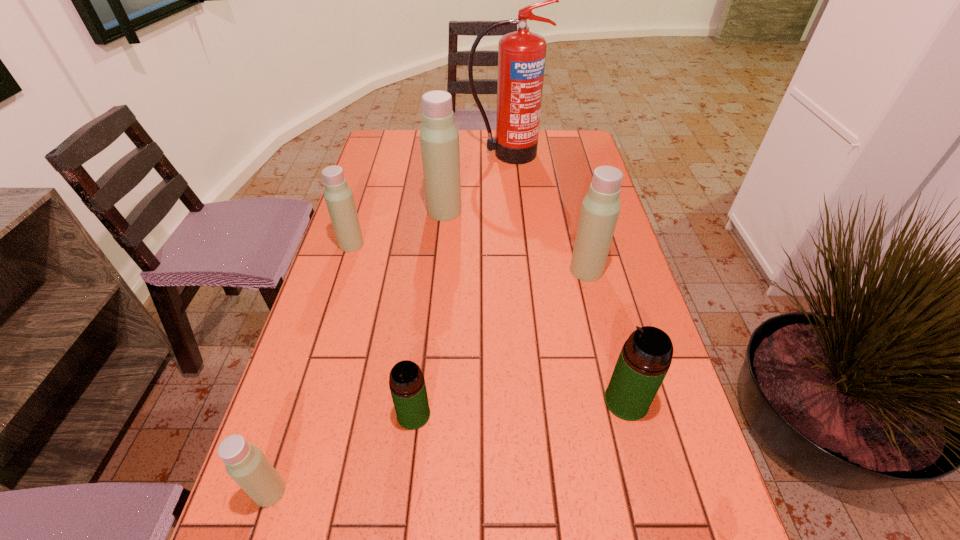
This screenshot has height=540, width=960. What are the coordinates of `the nearest thermos bottle` in the screenshot? It's located at (245, 463).

Locate an element on the screen. the smallest light thermos bottle is located at coordinates (245, 463).

Where is `vacant area located 0.240m on the surface of the fifth object from left to right`? This screenshot has height=540, width=960. vacant area located 0.240m on the surface of the fifth object from left to right is located at coordinates (511, 205).

At what (x,y) coordinates should I click in order to perform the action: click on vacant space located on the left of the farthest thermos bottle. Please return your answer as a coordinate pair (x, y). This screenshot has height=540, width=960. Looking at the image, I should click on (389, 211).

Where is `vacant position located on the left of the third tallest object`? This screenshot has width=960, height=540. vacant position located on the left of the third tallest object is located at coordinates (540, 270).

Locate an element on the screen. This screenshot has height=540, width=960. free space located 0.060m on the back of the fifth nearest thermos bottle is located at coordinates (358, 223).

Locate an element on the screen. vacant area situated from the spout of the right green thermos bottle is located at coordinates (570, 401).

Where is `free space located 0.130m from the spout of the right green thermos bottle`? This screenshot has height=540, width=960. free space located 0.130m from the spout of the right green thermos bottle is located at coordinates (541, 401).

At what (x,y) coordinates should I click in order to perform the action: click on vacant space located 0.050m from the spout of the right green thermos bottle. Please return your answer as a coordinate pair (x, y). Looking at the image, I should click on (580, 401).

Find the location of a particular element. The width and height of the screenshot is (960, 540). vacant point located from the spout of the left green thermos bottle is located at coordinates (406, 483).